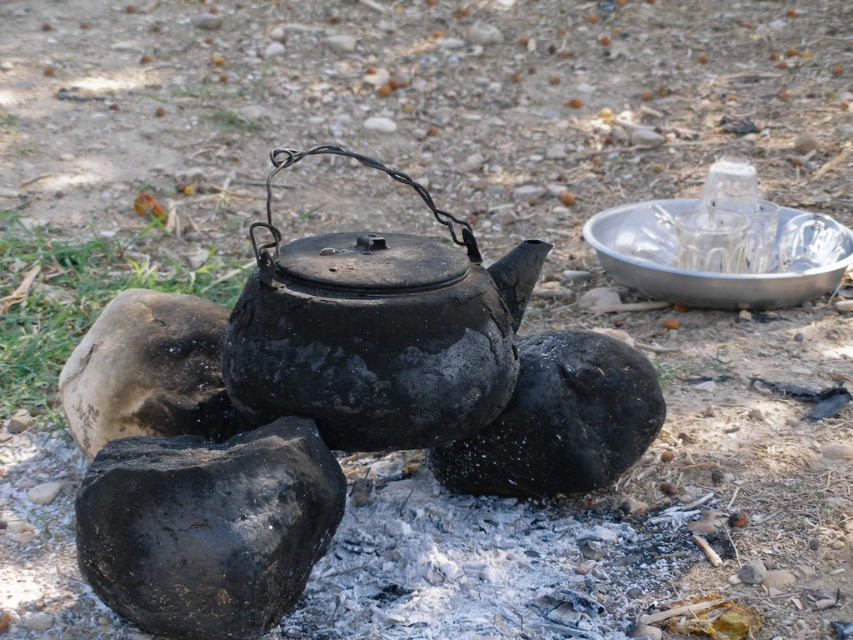
You are setting up a campfire and need to place a small metal stand between the charcoal black rock at center and the brown rough rock at left. Which rock should you place the stand closer to if you want the stand to be closer to the taller rock?

The brown rough rock at left is taller than the charcoal black rock at center, so you should place the stand closer to the brown rough rock at left.

You are a camper who just arrived at the campsite. You see the black matte teapot at center and the brown rough rock at left. Which object is directly on top of the other?

The black matte teapot at center is positioned over brown rough rock at left, so the teapot is directly on top of the rock.